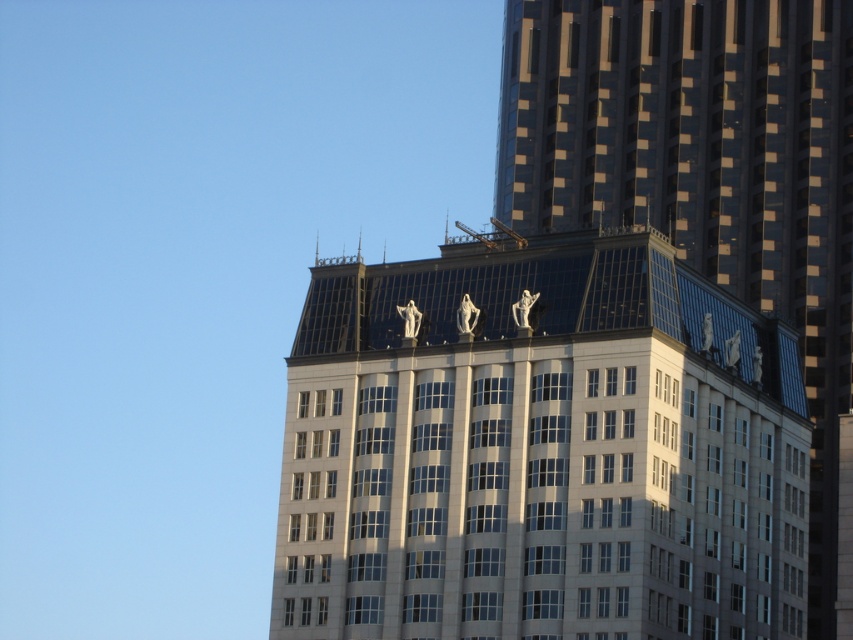
Question: Among these points, which one is nearest to the camera?

Choices:
 (A) (509, 22)
 (B) (733, 554)

Answer: (B)

Question: Which of the following is the farthest from the observer?

Choices:
 (A) white marble statues at upper center
 (B) reflective glass skyscraper at upper center

Answer: (A)

Question: Does white marble statues at upper center have a smaller size compared to reflective glass skyscraper at upper center?

Choices:
 (A) no
 (B) yes

Answer: (B)

Question: Considering the relative positions of white marble statues at upper center and reflective glass skyscraper at upper center in the image provided, where is white marble statues at upper center located with respect to reflective glass skyscraper at upper center?

Choices:
 (A) below
 (B) above

Answer: (A)

Question: Is white marble statues at upper center above reflective glass skyscraper at upper center?

Choices:
 (A) yes
 (B) no

Answer: (B)